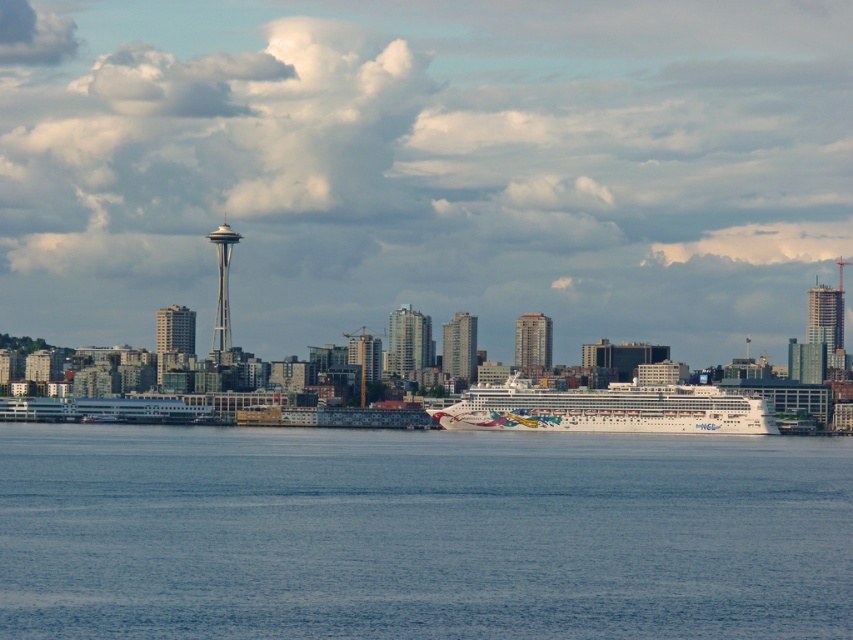
Question: Is glassy blue skyscraper at center below matte glass skyscraper at center-left?

Choices:
 (A) no
 (B) yes

Answer: (A)

Question: Considering the real-world distances, which object is closest to the green glass building at center?

Choices:
 (A) glassy blue skyscraper at center
 (B) blue water at center
 (C) glassy steel skyscraper at right

Answer: (A)

Question: Among these objects, which one is nearest to the camera?

Choices:
 (A) glassy blue skyscraper at center
 (B) smooth glass skyscraper at center
 (C) green glass building at center
 (D) blue water at center

Answer: (A)

Question: Which object is farther from the camera taking this photo?

Choices:
 (A) green glass building at center
 (B) glassy steel skyscraper at right

Answer: (B)

Question: Is matte glass skyscraper at center-left below glassy steel skyscraper at right?

Choices:
 (A) yes
 (B) no

Answer: (A)

Question: Is glassy blue skyscraper at center closer to the viewer compared to glassy steel skyscraper at right?

Choices:
 (A) no
 (B) yes

Answer: (B)